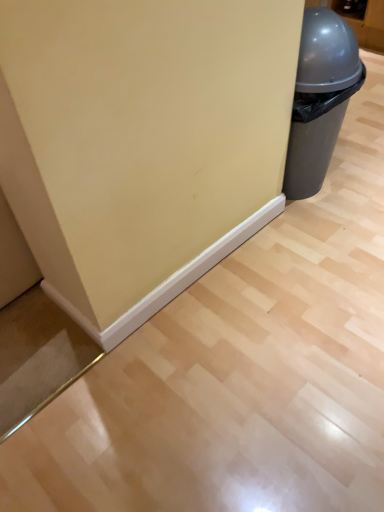
This screenshot has width=384, height=512. Describe the element at coordinates (320, 98) in the screenshot. I see `matte gray trash can at right` at that location.

The image size is (384, 512). In order to click on matte gray trash can at right in this screenshot , I will do `click(320, 98)`.

Identify the location of matte gray trash can at right. This screenshot has width=384, height=512. (320, 98).